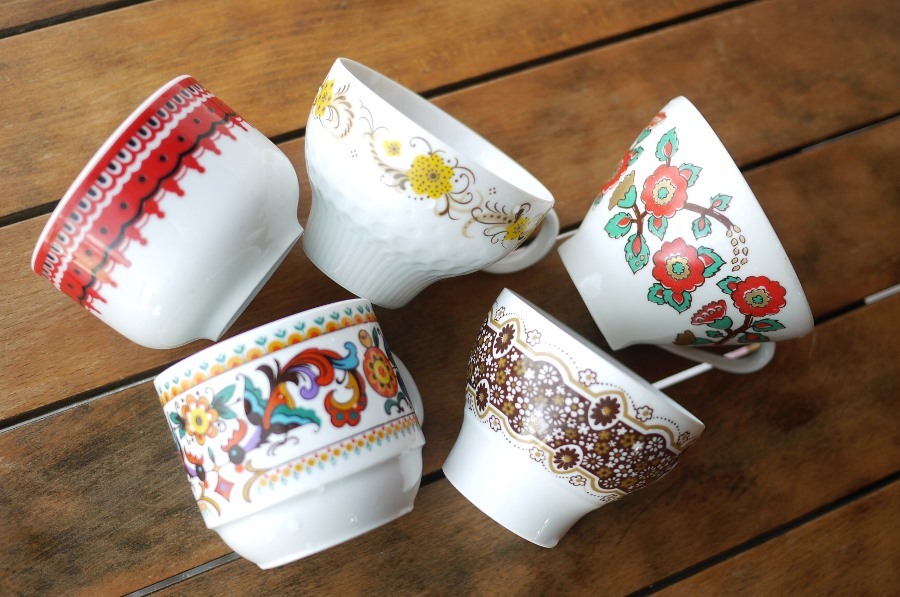
At what (x,y) coordinates should I click in order to perform the action: click on cup. Please return your answer as a coordinate pair (x, y). This screenshot has width=900, height=597. Looking at the image, I should click on (333, 453), (600, 407), (693, 260), (418, 210), (221, 230).